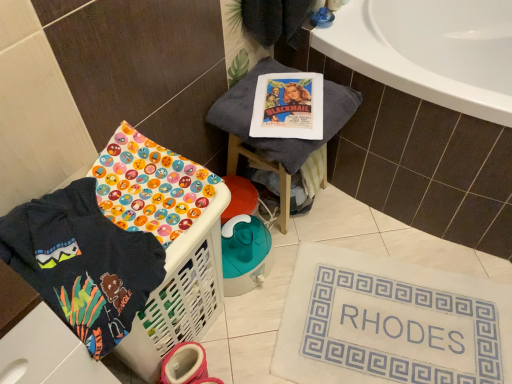
Locate an element on the screen. This screenshot has height=384, width=512. white fabric bath mat at lower right is located at coordinates (390, 323).

Locate an element on the screen. The height and width of the screenshot is (384, 512). white fabric bath mat at lower right is located at coordinates (390, 323).

From the image's perspective, between white plastic laundry basket at lower left and white fabric bath mat at lower right, which one is located above?

white plastic laundry basket at lower left is shown above in the image.

From a real-world perspective, is white plastic laundry basket at lower left physically below white fabric bath mat at lower right?

No, from a real-world perspective, white plastic laundry basket at lower left is not beneath white fabric bath mat at lower right.

In the image, there is a white plastic laundry basket at lower left. Where is `bath mat below it (from a real-world perspective)`? bath mat below it (from a real-world perspective) is located at coordinates (390, 323).

Considering the relative sizes of white plastic laundry basket at lower left and white fabric bath mat at lower right in the image provided, is white plastic laundry basket at lower left wider than white fabric bath mat at lower right?

No.

Are dark blue fabric at lower left and gray fabric stool at upper center located far from each other?

No, dark blue fabric at lower left is not far from gray fabric stool at upper center.

Considering the sizes of objects dark blue fabric at lower left and gray fabric stool at upper center in the image provided, who is smaller, dark blue fabric at lower left or gray fabric stool at upper center?

Smaller between the two is dark blue fabric at lower left.

Would you say dark blue fabric at lower left is inside or outside gray fabric stool at upper center?

dark blue fabric at lower left is not inside gray fabric stool at upper center, it's outside.

From a real-world perspective, between dark blue fabric at lower left and gray fabric stool at upper center, who is vertically higher?

In real-world perspective, dark blue fabric at lower left is above.

Is gray fabric stool at upper center not near white fabric bath mat at lower right?

No, gray fabric stool at upper center is not far from white fabric bath mat at lower right.

From the image's perspective, does gray fabric stool at upper center appear lower than white fabric bath mat at lower right?

Actually, gray fabric stool at upper center appears above white fabric bath mat at lower right in the image.

Is gray fabric stool at upper center spatially inside white fabric bath mat at lower right, or outside of it?

The correct answer is: outside.

Which is in front, gray fabric stool at upper center or white fabric bath mat at lower right?

white fabric bath mat at lower right is closer to the camera.

You are a GUI agent. You are given a task and a screenshot of the screen. Output one action in this format:
    pyautogui.click(x=<x>, y=<y>)
    Task: Click on the basket container in front of the gray fabric stool at upper center
    
    Given the screenshot: What is the action you would take?
    pyautogui.click(x=165, y=240)

From the image's perspective, is white plastic laundry basket at lower left under gray fabric stool at upper center?

Indeed, from the image's perspective, white plastic laundry basket at lower left is shown beneath gray fabric stool at upper center.

Considering the points (153, 291) and (284, 66), which point is in front, point (153, 291) or point (284, 66)?

Point (153, 291)

From the picture: From the image's perspective, would you say white plastic laundry basket at lower left is shown under dark blue fabric at lower left?

Correct, white plastic laundry basket at lower left appears lower than dark blue fabric at lower left in the image.

Looking at this image, considering the relative sizes of white plastic laundry basket at lower left and dark blue fabric at lower left in the image provided, is white plastic laundry basket at lower left thinner than dark blue fabric at lower left?

Indeed, white plastic laundry basket at lower left has a lesser width compared to dark blue fabric at lower left.

Does white plastic laundry basket at lower left have a smaller size compared to dark blue fabric at lower left?

No, white plastic laundry basket at lower left is not smaller than dark blue fabric at lower left.

Which is correct: white fabric bath mat at lower right is inside white plastic laundry basket at lower left, or outside of it?

white fabric bath mat at lower right lies outside white plastic laundry basket at lower left.

Can you confirm if white fabric bath mat at lower right is thinner than white plastic laundry basket at lower left?

No, white fabric bath mat at lower right is not thinner than white plastic laundry basket at lower left.

Could you tell me if white fabric bath mat at lower right is facing white plastic laundry basket at lower left?

No.

Does white fabric bath mat at lower right have a larger size compared to white plastic laundry basket at lower left?

Actually, white fabric bath mat at lower right might be smaller than white plastic laundry basket at lower left.

Considering their positions, is dark blue fabric at lower left located in front of or behind white plastic laundry basket at lower left?

Visually, dark blue fabric at lower left is located in front of white plastic laundry basket at lower left.

How different are the orientations of dark blue fabric at lower left and white plastic laundry basket at lower left in degrees?

The facing directions of dark blue fabric at lower left and white plastic laundry basket at lower left are 6.71e-05 degrees apart.

In the scene shown: Considering the positions of objects dark blue fabric at lower left and white plastic laundry basket at lower left in the image provided, who is more to the left, dark blue fabric at lower left or white plastic laundry basket at lower left?

Positioned to the left is dark blue fabric at lower left.

Is dark blue fabric at lower left located outside white plastic laundry basket at lower left?

Absolutely, dark blue fabric at lower left is external to white plastic laundry basket at lower left.

In the image, there is a white fabric bath mat at lower right. Identify the location of basket container above it (from the image's perspective). (165, 240).

Locate an element on the screen. furniture on the right of the dark blue fabric at lower left is located at coordinates (280, 138).

When comparing their distances from gray fabric stool at upper center, does white plastic laundry basket at lower left or white fabric bath mat at lower right seem further?

The object further to gray fabric stool at upper center is white fabric bath mat at lower right.

Which object lies nearer to the anchor point white plastic laundry basket at lower left, gray fabric stool at upper center or white fabric bath mat at lower right?

Among the two, gray fabric stool at upper center is located nearer to white plastic laundry basket at lower left.

Considering their positions, is dark blue fabric at lower left positioned further to white fabric bath mat at lower right than gray fabric stool at upper center?

Among the two, dark blue fabric at lower left is located further to white fabric bath mat at lower right.

Looking at the image, which one is located further to white fabric bath mat at lower right, gray fabric stool at upper center or dark blue fabric at lower left?

dark blue fabric at lower left is further to white fabric bath mat at lower right.

Considering their positions, is white fabric bath mat at lower right positioned closer to dark blue fabric at lower left than gray fabric stool at upper center?

Among the two, gray fabric stool at upper center is located nearer to dark blue fabric at lower left.

Which object lies nearer to the anchor point white fabric bath mat at lower right, white plastic laundry basket at lower left or gray fabric stool at upper center?

Among the two, white plastic laundry basket at lower left is located nearer to white fabric bath mat at lower right.

Considering their positions, is dark blue fabric at lower left positioned further to white plastic laundry basket at lower left than white fabric bath mat at lower right?

white fabric bath mat at lower right is further to white plastic laundry basket at lower left.

When comparing their distances from gray fabric stool at upper center, does white fabric bath mat at lower right or white plastic laundry basket at lower left seem closer?

The object closer to gray fabric stool at upper center is white plastic laundry basket at lower left.

You are a GUI agent. You are given a task and a screenshot of the screen. Output one action in this format:
    pyautogui.click(x=<x>, y=<y>)
    Task: Click on the basket container between dark blue fabric at lower left and gray fabric stool at upper center in the front-back direction
    This screenshot has width=512, height=384.
    Given the screenshot: What is the action you would take?
    pyautogui.click(x=165, y=240)

The image size is (512, 384). Identify the location of furniture between white plastic laundry basket at lower left and white fabric bath mat at lower right in the horizontal direction. (280, 138).

Locate an element on the screen. Image resolution: width=512 pixels, height=384 pixels. furniture located between dark blue fabric at lower left and white fabric bath mat at lower right in the left-right direction is located at coordinates (280, 138).

Locate an element on the screen. basket container located between dark blue fabric at lower left and white fabric bath mat at lower right in the left-right direction is located at coordinates (165, 240).